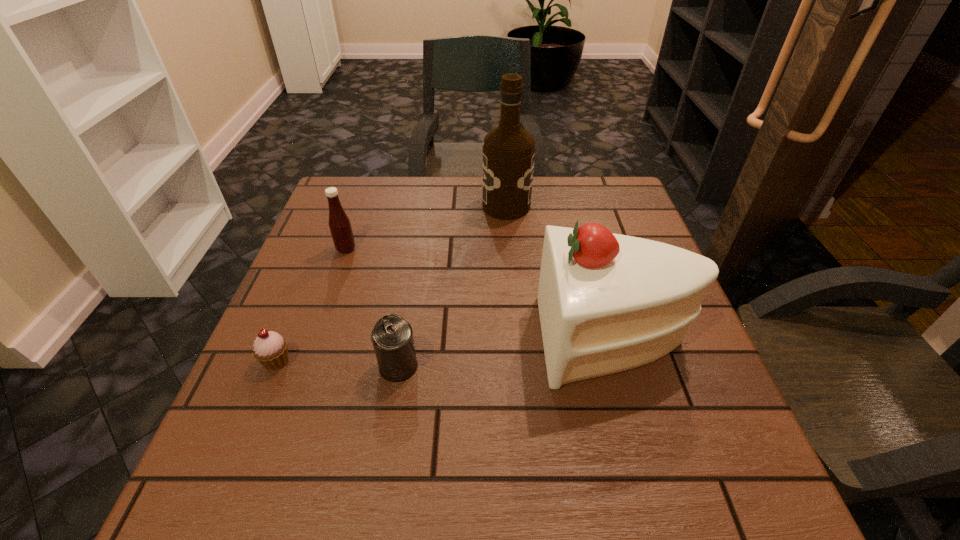
Locate an element on the screen. The height and width of the screenshot is (540, 960). free space located on the label of the tallest object is located at coordinates (377, 206).

At what (x,y) coordinates should I click in order to perform the action: click on free space located on the label of the tallest object. Please return your answer as a coordinate pair (x, y). Looking at the image, I should click on point(424,206).

The width and height of the screenshot is (960, 540). What are the coordinates of `vacant space located 0.130m on the front of the cake` in the screenshot? It's located at (648, 462).

Where is `vacant region located 0.120m on the right of the third tallest object`? The image size is (960, 540). vacant region located 0.120m on the right of the third tallest object is located at coordinates (405, 249).

I want to click on free space located on the right of the can, so click(x=615, y=366).

Where is `vacant area situated on the front of the shortest object`? The height and width of the screenshot is (540, 960). vacant area situated on the front of the shortest object is located at coordinates (220, 500).

Locate an element on the screen. The height and width of the screenshot is (540, 960). object that is at the far edge is located at coordinates pyautogui.click(x=508, y=152).

Find the location of a particular element. The image size is (960, 540). Tabasco sauce located at the left edge is located at coordinates (340, 227).

The width and height of the screenshot is (960, 540). In order to click on cupcake present at the left edge in this screenshot , I will do `click(270, 348)`.

This screenshot has width=960, height=540. I want to click on object present at the right edge, so click(x=607, y=302).